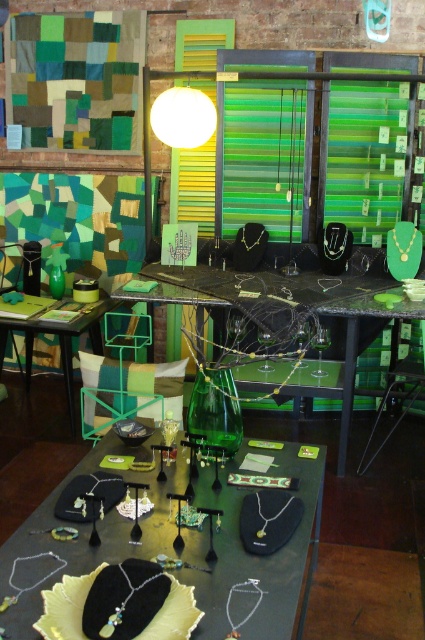
Is green glass table at center wider than white matte lampshade at upper center?

Indeed, green glass table at center has a greater width compared to white matte lampshade at upper center.

Is green glass table at center to the right of white matte lampshade at upper center from the viewer's perspective?

No, green glass table at center is not to the right of white matte lampshade at upper center.

Between point (45, 328) and point (206, 102), which one is positioned behind?

Positioned behind is point (45, 328).

Locate an element on the screen. Image resolution: width=425 pixels, height=640 pixels. green glass table at center is located at coordinates (59, 342).

Between point (16, 572) and point (257, 321), which one is positioned in front?

Point (16, 572) is in front.

Which is more to the left, shiny silver jewelry at center or green glass vase at center?

shiny silver jewelry at center is more to the left.

Is point (37, 588) in front of point (300, 356)?

Yes, point (37, 588) is closer to viewer.

The height and width of the screenshot is (640, 425). I want to click on shiny silver jewelry at center, so click(251, 554).

Does shiny silver jewelry at center have a greater height compared to green fabric pillow at center?

No, shiny silver jewelry at center is not taller than green fabric pillow at center.

Is shiny silver jewelry at center above green fabric pillow at center?

Actually, shiny silver jewelry at center is below green fabric pillow at center.

Where is `shiny silver jewelry at center`? shiny silver jewelry at center is located at coordinates (251, 554).

Locate an element on the screen. The image size is (425, 640). shiny silver jewelry at center is located at coordinates (251, 554).